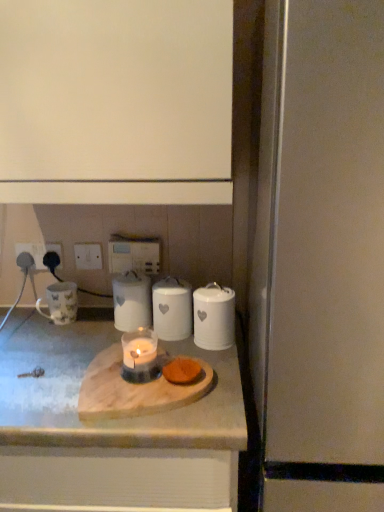
You are a GUI agent. You are given a task and a screenshot of the screen. Output one action in this format:
    pyautogui.click(x=<x>, y=<y>)
    Task: Click on the vacant area that is in front of orange sponge at center
    This screenshot has height=512, width=384.
    Given the screenshot: What is the action you would take?
    pyautogui.click(x=179, y=414)